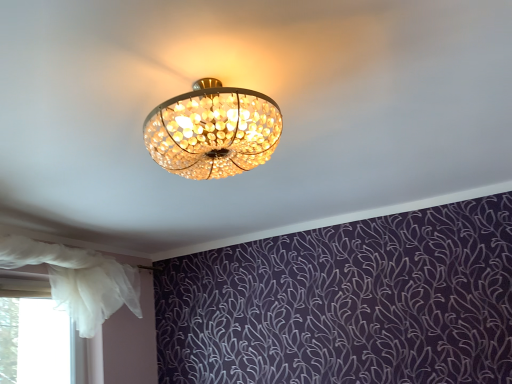
Question: Does white sheer curtain at left turn towards white sheer curtain at lower left?

Choices:
 (A) no
 (B) yes

Answer: (A)

Question: Does white sheer curtain at left have a greater width compared to white sheer curtain at lower left?

Choices:
 (A) no
 (B) yes

Answer: (B)

Question: Is white sheer curtain at left looking in the opposite direction of white sheer curtain at lower left?

Choices:
 (A) yes
 (B) no

Answer: (A)

Question: Is white sheer curtain at left next to white sheer curtain at lower left and touching it?

Choices:
 (A) yes
 (B) no

Answer: (B)

Question: Are white sheer curtain at left and white sheer curtain at lower left located far from each other?

Choices:
 (A) yes
 (B) no

Answer: (B)

Question: From the image's perspective, does white sheer curtain at left appear higher than white sheer curtain at lower left?

Choices:
 (A) yes
 (B) no

Answer: (A)

Question: From the image's perspective, would you say white sheer curtain at lower left is shown under white sheer curtain at left?

Choices:
 (A) no
 (B) yes

Answer: (B)

Question: Does white sheer curtain at lower left have a smaller size compared to white sheer curtain at left?

Choices:
 (A) no
 (B) yes

Answer: (B)

Question: Is white sheer curtain at lower left shorter than white sheer curtain at left?

Choices:
 (A) no
 (B) yes

Answer: (A)

Question: Is white sheer curtain at lower left at the right side of white sheer curtain at left?

Choices:
 (A) yes
 (B) no

Answer: (B)

Question: Is white sheer curtain at lower left far from white sheer curtain at left?

Choices:
 (A) no
 (B) yes

Answer: (A)

Question: Can you confirm if white sheer curtain at lower left is taller than white sheer curtain at left?

Choices:
 (A) yes
 (B) no

Answer: (A)

Question: From a real-world perspective, is white sheer curtain at left above or below white sheer curtain at lower left?

Choices:
 (A) above
 (B) below

Answer: (A)